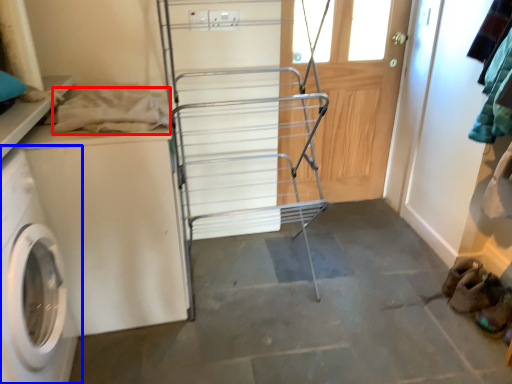
Question: Which object appears farthest to the camera in this image, clothing (highlighted by a red box) or washing machine (highlighted by a blue box)?

Choices:
 (A) clothing
 (B) washing machine

Answer: (A)